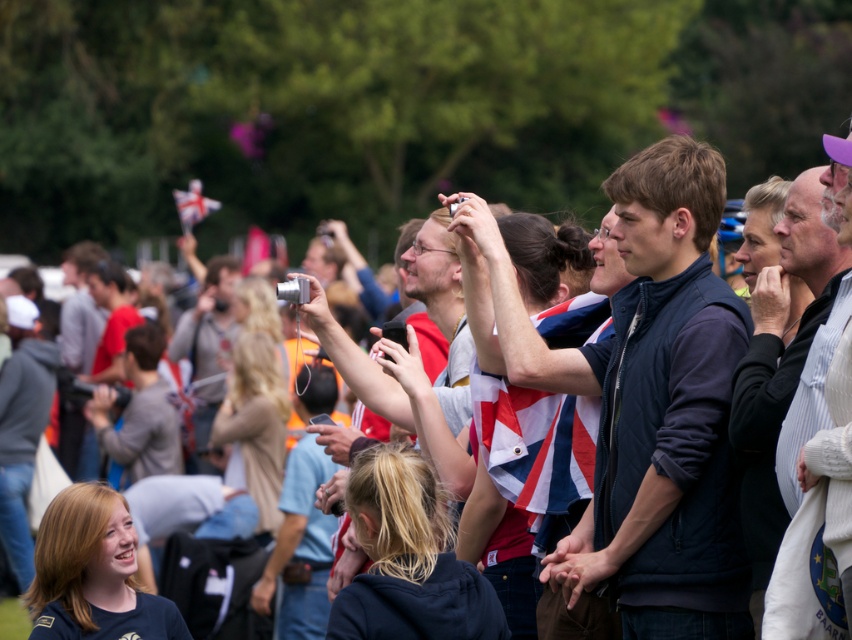
You are a photographer trying to capture the white fabric flag at upper center in your shot. The flag is located at coordinates point 0.320, 0.227. If your camera has a field of view that covers an area from point 0.2 to 0.4 on the x and y axes, will the flag be fully visible in your photo?

The white fabric flag at upper center is positioned at point (193,204). Since the camera covers from 0.2 to 0.4 on both axes, the flag is within this range and will be fully visible in the photo.

You are a photographer standing at the camera position in the scene. You want to capture a closeup shot of the white fabric flag at upper center. Given that your camera can focus up to 50 meters, will you be able to focus on the flag?

The white fabric flag at upper center is 56.64 meters away from the camera, which exceeds the camera focus limit of 50 meters. Therefore, the camera cannot focus on the flag.